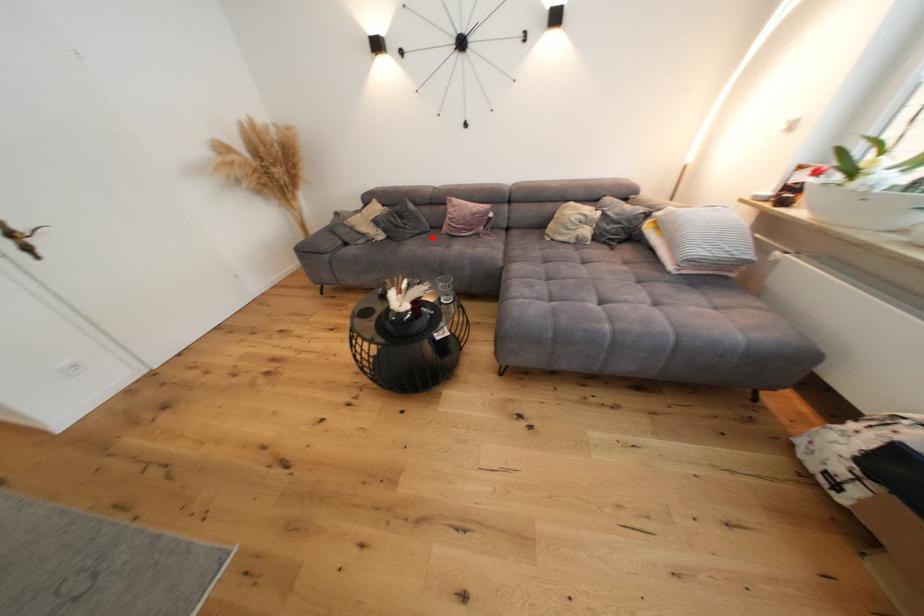
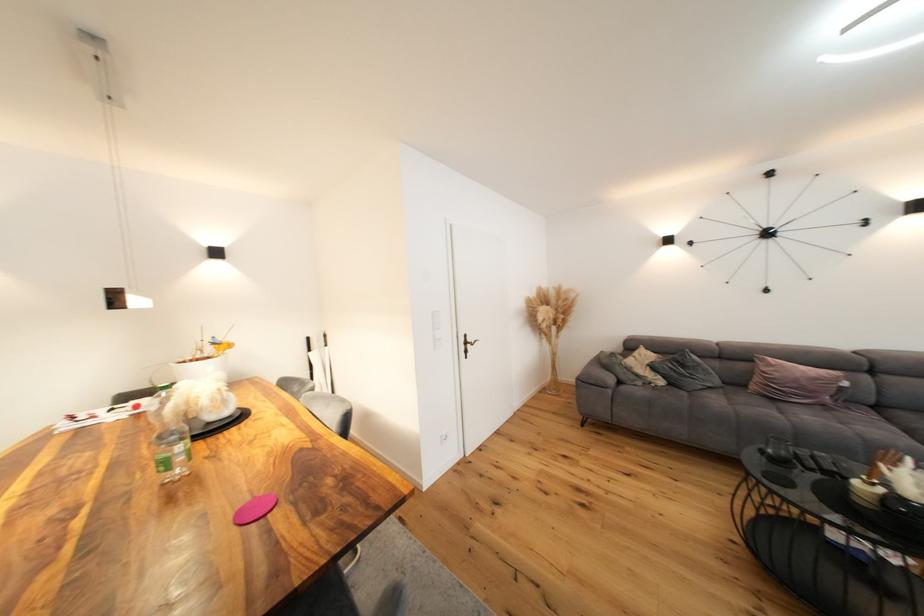
Where in the second image is the point corresponding to the highlighted location from the first image?

(727, 392)